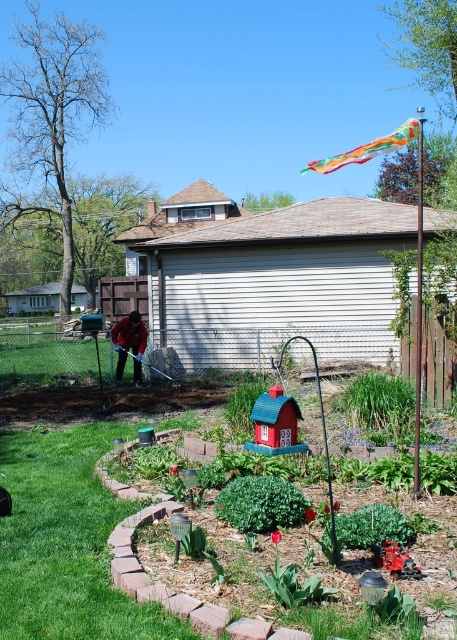
You are standing at the location of the dark red sweater at center and want to fly the rainbow fabric kite at upper right. Considering the distance between them, can you estimate if you have enough space to run and fly the kite without any obstacles?

The rainbow fabric kite at upper right is 18.03 meters away from the dark red sweater at center. This distance provides sufficient space to run and fly the kite safely, assuming there are no obstacles in between.

You are standing at the camera position in the backyard scene and want to retrieve the rainbow fabric kite at upper right. Given that you can walk 5 meters before needing to rest, how many times will you need to rest to reach it?

The rainbow fabric kite at upper right is 6.26 meters away from the camera. Since you can walk 5 meters before resting, you will need to rest once before reaching the kite.

You are standing in the backyard and want to hang a new bird feeder between the rainbow fabric kite at upper right and the dark red sweater at center. Which object should you place the bird feeder closer to if you want it to be on the left side of the kite?

The bird feeder should be placed closer to the dark red sweater at center because the rainbow fabric kite at upper right is to the right of the dark red sweater at center, so positioning it near the sweater would keep it to the left of the kite.